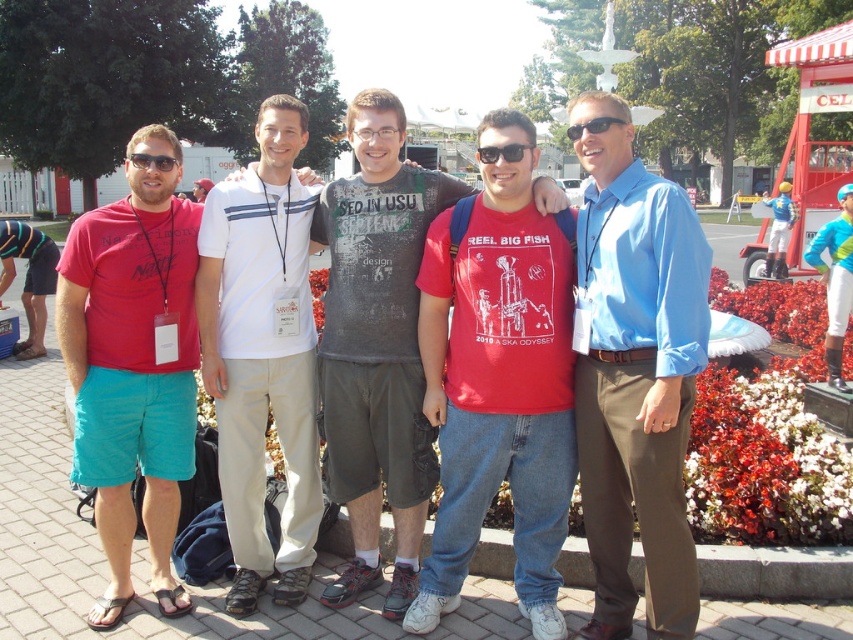
Question: Which point is closer to the camera?

Choices:
 (A) (624, 406)
 (B) (80, 435)

Answer: (A)

Question: Among these objects, which one is nearest to the camera?

Choices:
 (A) red cotton t-shirt at center
 (B) white cotton polo shirt at center
 (C) black plastic sunglasses at center
 (D) blue smooth shirt at center

Answer: (D)

Question: Considering the relative positions of matte red t-shirt at left and matte black sunglasses at left in the image provided, where is matte red t-shirt at left located with respect to matte black sunglasses at left?

Choices:
 (A) below
 (B) above

Answer: (A)

Question: From the image, what is the correct spatial relationship of red cotton t-shirt at center in relation to matte red t-shirt at left?

Choices:
 (A) above
 (B) below

Answer: (A)

Question: Is red cotton t-shirt at center positioned behind matte red t-shirt at left?

Choices:
 (A) no
 (B) yes

Answer: (A)

Question: Which of the following is the closest to the observer?

Choices:
 (A) [x=292, y=602]
 (B) [x=97, y=234]
 (C) [x=618, y=468]

Answer: (C)